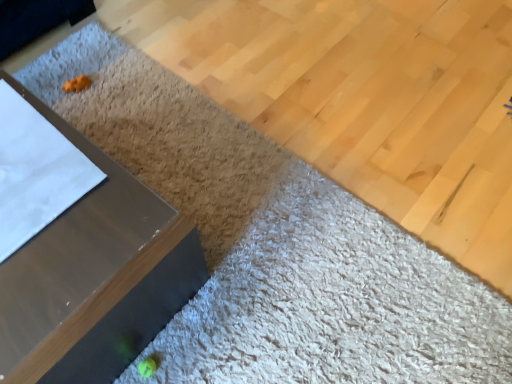
This screenshot has height=384, width=512. Identify the location of matte wood plywood at lower left. (364, 99).

The width and height of the screenshot is (512, 384). What do you see at coordinates (364, 99) in the screenshot? I see `matte wood plywood at lower left` at bounding box center [364, 99].

What is the approximate height of matte wood plywood at lower left?

1.54 inches.

The width and height of the screenshot is (512, 384). What do you see at coordinates (94, 277) in the screenshot?
I see `metallic gray table at left` at bounding box center [94, 277].

Where is `metallic gray table at left`? This screenshot has width=512, height=384. metallic gray table at left is located at coordinates (94, 277).

Measure the distance between point (195, 261) and camera.

The depth of point (195, 261) is 1.04 meters.

Locate an element on the screen. The height and width of the screenshot is (384, 512). matte wood plywood at lower left is located at coordinates (364, 99).

Is metallic gray table at left to the left of matte wood plywood at lower left from the viewer's perspective?

Yes, metallic gray table at left is to the left of matte wood plywood at lower left.

Between metallic gray table at left and matte wood plywood at lower left, which one is positioned behind?

matte wood plywood at lower left is more distant.

Which is nearer, (87,381) or (424,104)?

Point (87,381).

From the image's perspective, between metallic gray table at left and matte wood plywood at lower left, who is located below?

metallic gray table at left is shown below in the image.

From the picture: From a real-world perspective, is metallic gray table at left under matte wood plywood at lower left?

Incorrect, from a real-world perspective, metallic gray table at left is higher than matte wood plywood at lower left.

Which object is thinner, metallic gray table at left or matte wood plywood at lower left?

Thinner between the two is metallic gray table at left.

Can you confirm if metallic gray table at left is taller than matte wood plywood at lower left?

Yes, metallic gray table at left is taller than matte wood plywood at lower left.

Considering the relative sizes of metallic gray table at left and matte wood plywood at lower left in the image provided, is metallic gray table at left bigger than matte wood plywood at lower left?

Incorrect, metallic gray table at left is not larger than matte wood plywood at lower left.

Would you say metallic gray table at left is inside or outside matte wood plywood at lower left?

metallic gray table at left is spatially situated outside matte wood plywood at lower left.

Are metallic gray table at left and matte wood plywood at lower left far apart?

Actually, metallic gray table at left and matte wood plywood at lower left are a little close together.

Is metallic gray table at left oriented away from matte wood plywood at lower left?

metallic gray table at left does not have its back to matte wood plywood at lower left.

Where is `furniture lying below the matte wood plywood at lower left (from the image's perspective)`? This screenshot has height=384, width=512. furniture lying below the matte wood plywood at lower left (from the image's perspective) is located at coordinates (94, 277).

Considering the relative positions of matte wood plywood at lower left and metallic gray table at left in the image provided, is matte wood plywood at lower left to the right of metallic gray table at left from the viewer's perspective?

Indeed, matte wood plywood at lower left is positioned on the right side of metallic gray table at left.

Which object is more forward, matte wood plywood at lower left or metallic gray table at left?

metallic gray table at left.

Does point (239, 37) lie behind point (13, 88)?

Yes, it is.

From the image's perspective, which object appears higher, matte wood plywood at lower left or metallic gray table at left?

matte wood plywood at lower left.

From a real-world perspective, is matte wood plywood at lower left on metallic gray table at left?

No, from a real-world perspective, matte wood plywood at lower left is not on top of metallic gray table at left.

Between matte wood plywood at lower left and metallic gray table at left, which one has larger width?

matte wood plywood at lower left.

Who is shorter, matte wood plywood at lower left or metallic gray table at left?

With less height is matte wood plywood at lower left.

Considering the sizes of objects matte wood plywood at lower left and metallic gray table at left in the image provided, who is smaller, matte wood plywood at lower left or metallic gray table at left?

metallic gray table at left.

Is matte wood plywood at lower left not within metallic gray table at left?

matte wood plywood at lower left lies outside metallic gray table at left's area.

Is matte wood plywood at lower left with metallic gray table at left?

matte wood plywood at lower left and metallic gray table at left are clearly separated.

Does matte wood plywood at lower left turn towards metallic gray table at left?

No, matte wood plywood at lower left is not turned towards metallic gray table at left.

How different are the orientations of matte wood plywood at lower left and metallic gray table at left in degrees?

matte wood plywood at lower left and metallic gray table at left are facing 90.4 degrees away from each other.

The height and width of the screenshot is (384, 512). In order to click on plywood on the right of metallic gray table at left in this screenshot , I will do `click(364, 99)`.

At what (x,y) coordinates should I click in order to perform the action: click on furniture that is below the matte wood plywood at lower left (from the image's perspective). Please return your answer as a coordinate pair (x, y). The image size is (512, 384). Looking at the image, I should click on (94, 277).

The image size is (512, 384). In order to click on furniture above the matte wood plywood at lower left (from a real-world perspective) in this screenshot , I will do `click(94, 277)`.